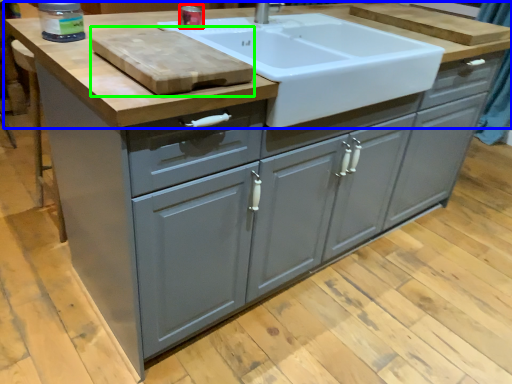
Question: Which is nearer to the appliance (highlighted by a red box)? countertop (highlighted by a blue box) or cutting board (highlighted by a green box).

Choices:
 (A) countertop
 (B) cutting board

Answer: (A)